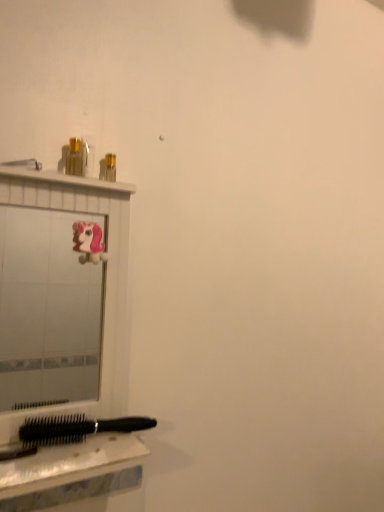
Identify the location of metallic gold toiletry at upper left. The image size is (384, 512). (77, 157).

Where is `matte white shower at upper left`? matte white shower at upper left is located at coordinates (24, 163).

The width and height of the screenshot is (384, 512). What do you see at coordinates (72, 472) in the screenshot?
I see `black plastic hairbrush at lower left` at bounding box center [72, 472].

The image size is (384, 512). Identify the location of white glossy mirror at upper left. (47, 309).

From the image's perspective, which one is positioned lower, matte white shower at upper left or black plastic hairbrush at lower left?

From the image's view, black plastic hairbrush at lower left is below.

Looking at this image, considering the relative positions of matte white shower at upper left and black plastic hairbrush at lower left in the image provided, is matte white shower at upper left in front of black plastic hairbrush at lower left?

No, the depth of matte white shower at upper left is greater than that of black plastic hairbrush at lower left.

Considering the sizes of objects matte white shower at upper left and black plastic hairbrush at lower left in the image provided, who is taller, matte white shower at upper left or black plastic hairbrush at lower left?

black plastic hairbrush at lower left.

Based on the photo, between white glossy mirror at upper left and metallic gold toiletry at upper left, which one has less height?

With less height is metallic gold toiletry at upper left.

Based on the photo, from the image's perspective, which one is positioned lower, white glossy mirror at upper left or metallic gold toiletry at upper left?

white glossy mirror at upper left is shown below in the image.

Is white glossy mirror at upper left aimed at metallic gold toiletry at upper left?

No, white glossy mirror at upper left does not turn towards metallic gold toiletry at upper left.

Considering the positions of objects white glossy mirror at upper left and metallic gold toiletry at upper left in the image provided, who is in front, white glossy mirror at upper left or metallic gold toiletry at upper left?

Positioned in front is white glossy mirror at upper left.

Considering their positions, is metallic gold toiletry at upper left located in front of or behind matte white shower at upper left?

In the image, metallic gold toiletry at upper left appears behind matte white shower at upper left.

Which of these two, metallic gold toiletry at upper left or matte white shower at upper left, is bigger?

metallic gold toiletry at upper left.

Does metallic gold toiletry at upper left appear on the left side of matte white shower at upper left?

In fact, metallic gold toiletry at upper left is to the right of matte white shower at upper left.

Is metallic gold toiletry at upper left facing towards matte white shower at upper left?

No, metallic gold toiletry at upper left does not turn towards matte white shower at upper left.

Is metallic gold toiletry at upper left positioned far away from white glossy mirror at upper left?

metallic gold toiletry at upper left is far away from white glossy mirror at upper left.

Which is farther, [81,168] or [93,306]?

Positioned behind is point [93,306].

Between metallic gold toiletry at upper left and white glossy mirror at upper left, which one has less height?

metallic gold toiletry at upper left is shorter.

Image resolution: width=384 pixels, height=512 pixels. Identify the location of toiletry above the black plastic hairbrush at lower left (from a real-world perspective). (77, 157).

From the image's perspective, is metallic gold toiletry at upper left positioned above or below black plastic hairbrush at lower left?

metallic gold toiletry at upper left is above black plastic hairbrush at lower left.

Does metallic gold toiletry at upper left turn towards black plastic hairbrush at lower left?

No.

Is metallic gold toiletry at upper left located outside black plastic hairbrush at lower left?

That's correct, metallic gold toiletry at upper left is outside of black plastic hairbrush at lower left.

Can you confirm if white glossy mirror at upper left is bigger than matte white shower at upper left?

Yes, white glossy mirror at upper left is bigger than matte white shower at upper left.

Is white glossy mirror at upper left positioned with its back to matte white shower at upper left?

white glossy mirror at upper left does not have its back to matte white shower at upper left.

How different are the orientations of white glossy mirror at upper left and matte white shower at upper left in degrees?

0.00212 degrees separate the facing orientations of white glossy mirror at upper left and matte white shower at upper left.

Locate an element on the screen. The image size is (384, 512). table in front of the white glossy mirror at upper left is located at coordinates (72, 472).

From a real-world perspective, is black plastic hairbrush at lower left physically below white glossy mirror at upper left?

Indeed, from a real-world perspective, black plastic hairbrush at lower left is positioned beneath white glossy mirror at upper left.

Considering the relative positions of black plastic hairbrush at lower left and white glossy mirror at upper left in the image provided, is black plastic hairbrush at lower left to the left or to the right of white glossy mirror at upper left?

Based on their positions, black plastic hairbrush at lower left is located to the left of white glossy mirror at upper left.

Looking at this image, is black plastic hairbrush at lower left looking in the opposite direction of white glossy mirror at upper left?

No, black plastic hairbrush at lower left is not facing the opposite direction of white glossy mirror at upper left.

Identify the location of table below the matte white shower at upper left (from a real-world perspective). Image resolution: width=384 pixels, height=512 pixels. (72, 472).

Locate an element on the screen. mirror in front of the metallic gold toiletry at upper left is located at coordinates (47, 309).

Which object lies further to the anchor point black plastic hairbrush at lower left, matte white shower at upper left or metallic gold toiletry at upper left?

matte white shower at upper left is positioned further to the anchor black plastic hairbrush at lower left.

From the image, which object appears to be farther from matte white shower at upper left, white glossy mirror at upper left or black plastic hairbrush at lower left?

white glossy mirror at upper left lies further to matte white shower at upper left than the other object.

When comparing their distances from matte white shower at upper left, does black plastic hairbrush at lower left or metallic gold toiletry at upper left seem further?

black plastic hairbrush at lower left is further to matte white shower at upper left.

Looking at the image, which one is located closer to white glossy mirror at upper left, matte white shower at upper left or metallic gold toiletry at upper left?

Among the two, metallic gold toiletry at upper left is located nearer to white glossy mirror at upper left.

Based on their spatial positions, is white glossy mirror at upper left or metallic gold toiletry at upper left closer to matte white shower at upper left?

Among the two, metallic gold toiletry at upper left is located nearer to matte white shower at upper left.

Looking at this image, considering their positions, is metallic gold toiletry at upper left positioned further to black plastic hairbrush at lower left than white glossy mirror at upper left?

white glossy mirror at upper left is positioned further to the anchor black plastic hairbrush at lower left.

Considering their positions, is matte white shower at upper left positioned closer to black plastic hairbrush at lower left than white glossy mirror at upper left?

Based on the image, matte white shower at upper left appears to be nearer to black plastic hairbrush at lower left.

Based on their spatial positions, is black plastic hairbrush at lower left or white glossy mirror at upper left further from metallic gold toiletry at upper left?

Based on the image, white glossy mirror at upper left appears to be further to metallic gold toiletry at upper left.

Identify the location of mirror between metallic gold toiletry at upper left and black plastic hairbrush at lower left from top to bottom. The height and width of the screenshot is (512, 384). (47, 309).

You are a GUI agent. You are given a task and a screenshot of the screen. Output one action in this format:
    pyautogui.click(x=<x>, y=<y>)
    Task: Click on the shower between metallic gold toiletry at upper left and white glossy mirror at upper left vertically
    The width and height of the screenshot is (384, 512).
    Given the screenshot: What is the action you would take?
    pyautogui.click(x=24, y=163)

The image size is (384, 512). Identify the location of shower between metallic gold toiletry at upper left and black plastic hairbrush at lower left in the up-down direction. (24, 163).

Find the location of `mirror between matte white shower at upper left and black plastic hairbrush at lower left vertically`. mirror between matte white shower at upper left and black plastic hairbrush at lower left vertically is located at coordinates (47, 309).